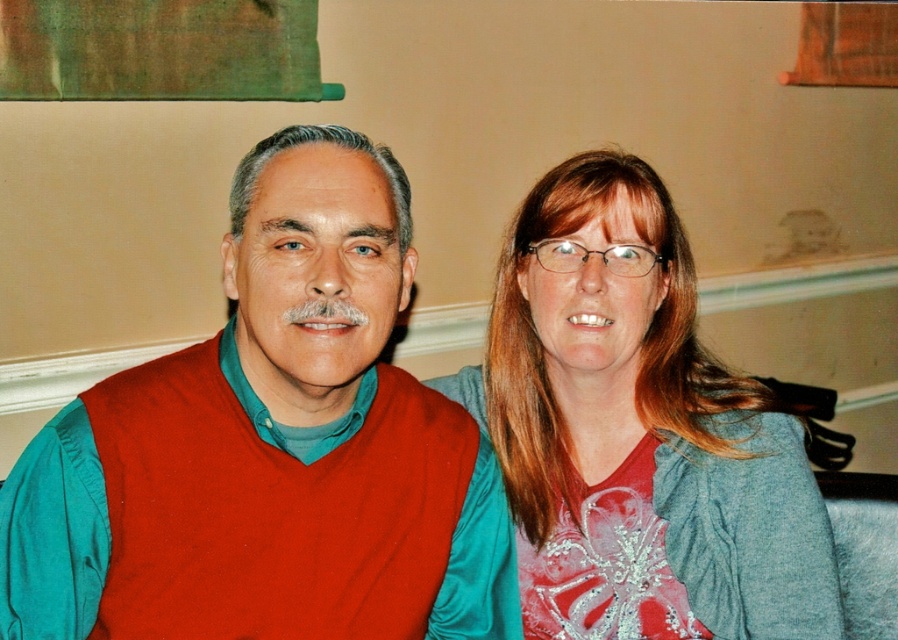
You are a fashion designer observing the two red garments in the scene. Which one is bigger between the matte red shirt at center and the matte red vest at center?

The matte red shirt at center is larger in size than the matte red vest at center.